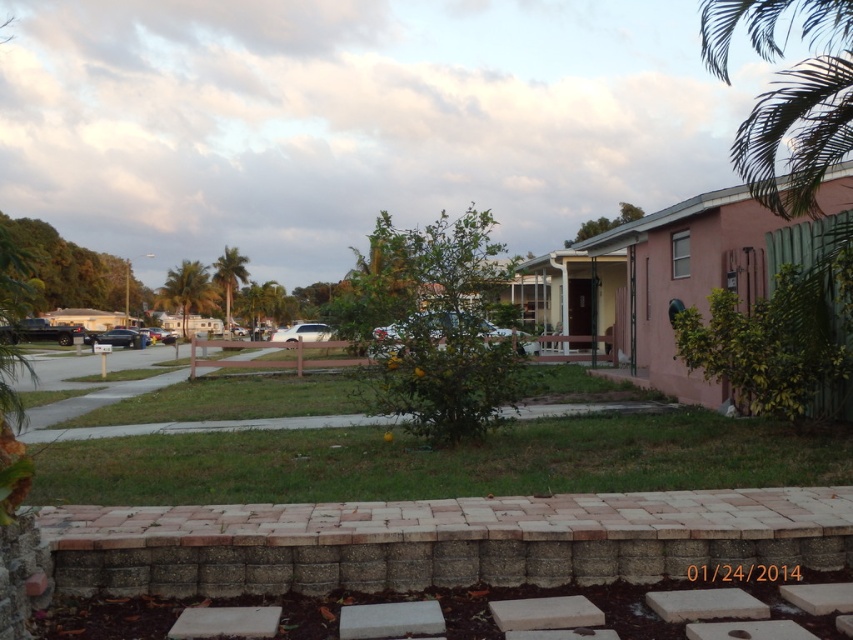
You are standing in the suburban residential scene and want to place a small garden ornament between the two points labeled as point (177,298) and point (245,289). Which point should you move towards first if you want the ornament closer to the camera?

You should move towards point (177,298) first because it is closer to the camera compared to point (245,289), so placing the ornament there will make it appear closer.

You are a gardener who needs to mow the lawn. You have a lawnmower that can only cut grass up to 10 cm tall. Based on the scene, can you safely mow the green grass at center without damaging the green leafy palm tree at left?

The green grass at center is shorter than the green leafy palm tree at left. Since the lawnmower can cut grass up to 10 cm tall, and the grass is shorter than the tree, it is safe to mow the green grass at center without damaging the green leafy palm tree at left.